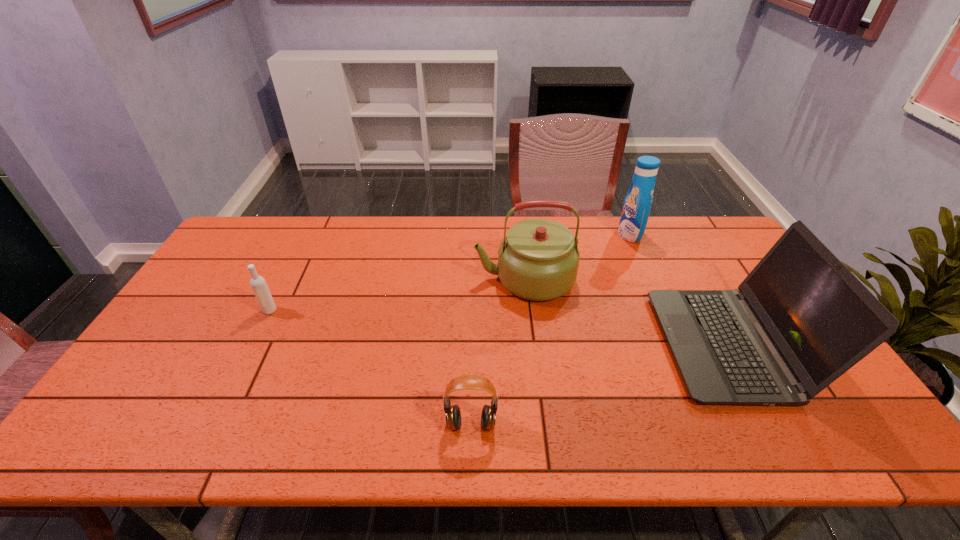
In the image, there is a desktop. What are the coordinates of `free region at the near edge` in the screenshot? It's located at (220, 422).

Image resolution: width=960 pixels, height=540 pixels. I want to click on vacant point at the left edge, so click(200, 291).

Find the location of `free space at the far left corner of the desktop`. free space at the far left corner of the desktop is located at coordinates (254, 244).

Where is `vacant area that lies between the laptop_computer and the headset`? The width and height of the screenshot is (960, 540). vacant area that lies between the laptop_computer and the headset is located at coordinates (599, 384).

Find the location of a particular element. Image resolution: width=960 pixels, height=540 pixels. empty space between the nearest object and the kettle is located at coordinates (497, 352).

You are a GUI agent. You are given a task and a screenshot of the screen. Output one action in this format:
    pyautogui.click(x=<x>, y=<y>)
    Task: Click on the vacant space that's between the detergent and the laptop_computer
    
    Given the screenshot: What is the action you would take?
    679,289

At what (x,y) coordinates should I click in order to perform the action: click on unoccupied position between the laptop_computer and the farthest object. Please return your answer as a coordinate pair (x, y). Image resolution: width=960 pixels, height=540 pixels. Looking at the image, I should click on (679, 289).

Locate an element on the screen. unoccupied position between the laptop_computer and the nearest object is located at coordinates (599, 384).

I want to click on vacant region between the kettle and the laptop_computer, so click(626, 312).

Locate an element on the screen. vacant region between the kettle and the laptop_computer is located at coordinates (626, 312).